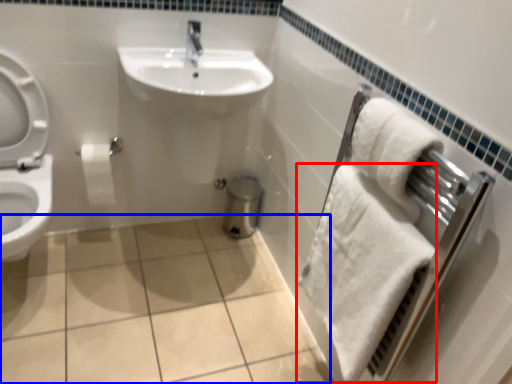
Question: Among these objects, which one is farthest to the camera, bath towel (highlighted by a red box) or ceramic tile (highlighted by a blue box)?

Choices:
 (A) bath towel
 (B) ceramic tile

Answer: (B)